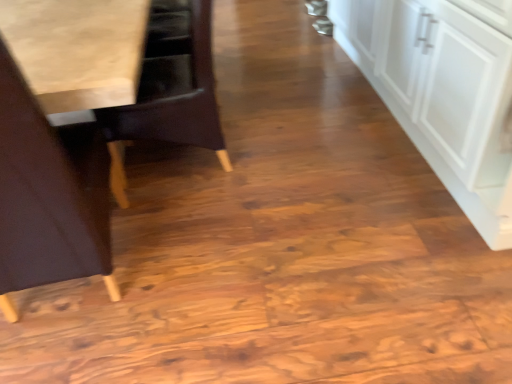
What is the approximate width of white matte cabinet at right?

white matte cabinet at right is 24.91 inches in width.

Find the location of a particular element. This screenshot has width=512, height=384. light brown wood chair at left, which is counted as the second chair, starting from the back is located at coordinates (49, 196).

Where is `wooden chair at left, which is the 2th chair from front to back`? The height and width of the screenshot is (384, 512). wooden chair at left, which is the 2th chair from front to back is located at coordinates (169, 92).

Is point (483, 60) less distant than point (15, 151)?

No, (483, 60) is further to viewer.

From the picture: Does white matte cabinet at right have a larger size compared to light brown wood chair at left, arranged as the first chair when viewed from the front?

Indeed, white matte cabinet at right has a larger size compared to light brown wood chair at left, arranged as the first chair when viewed from the front.

Is white matte cabinet at right looking in the opposite direction of light brown wood chair at left, arranged as the first chair when viewed from the front?

white matte cabinet at right is not turned away from light brown wood chair at left, arranged as the first chair when viewed from the front.

From the image's perspective, is white matte cabinet at right positioned above or below light brown wood chair at left, arranged as the first chair when viewed from the front?

white matte cabinet at right is situated higher than light brown wood chair at left, arranged as the first chair when viewed from the front, in the image.

Is point (106, 214) closer to camera compared to point (426, 104)?

Yes.

Would you say white matte cabinet at right is part of light brown wood chair at left, which is counted as the second chair, starting from the back,'s contents?

No, white matte cabinet at right is located outside of light brown wood chair at left, which is counted as the second chair, starting from the back.

From the picture: Which object is positioned more to the left, light brown wood chair at left, which is counted as the second chair, starting from the back, or white matte cabinet at right?

Positioned to the left is light brown wood chair at left, which is counted as the second chair, starting from the back.

Are light brown wood chair at left, which is counted as the second chair, starting from the back, and wooden chair at left, positioned as the first chair in back-to-front order, beside each other?

No, light brown wood chair at left, which is counted as the second chair, starting from the back, is not next to wooden chair at left, positioned as the first chair in back-to-front order.

In the scene shown: Could you tell me if light brown wood chair at left, which is counted as the second chair, starting from the back, is facing wooden chair at left, positioned as the first chair in back-to-front order?

No.

I want to click on chair below the light brown wood chair at left, arranged as the first chair when viewed from the front (from a real-world perspective), so click(169, 92).

Is the depth of wooden chair at left, positioned as the first chair in back-to-front order, less than that of light brown wood chair at left, arranged as the first chair when viewed from the front?

No, it is not.

Which is more distant, (x=205, y=5) or (x=104, y=186)?

The point (x=205, y=5) is farther.

From the image's perspective, is wooden chair at left, positioned as the first chair in back-to-front order, below light brown wood chair at left, arranged as the first chair when viewed from the front?

No.

Between wooden chair at left, which is the 2th chair from front to back, and light brown wood chair at left, which is counted as the second chair, starting from the back, which one has smaller width?

With smaller width is wooden chair at left, which is the 2th chair from front to back.

What's the angular difference between white matte cabinet at right and wooden chair at left, positioned as the first chair in back-to-front order,'s facing directions?

The facing directions of white matte cabinet at right and wooden chair at left, positioned as the first chair in back-to-front order, are 0.659 degrees apart.

Does point (455, 32) lie behind point (142, 123)?

No, it is not.

From a real-world perspective, is white matte cabinet at right on top of wooden chair at left, which is the 2th chair from front to back?

Incorrect, from a real-world perspective, white matte cabinet at right is lower than wooden chair at left, which is the 2th chair from front to back.

Is white matte cabinet at right positioned far away from wooden chair at left, positioned as the first chair in back-to-front order?

Indeed, white matte cabinet at right is not near wooden chair at left, positioned as the first chair in back-to-front order.

Does wooden chair at left, positioned as the first chair in back-to-front order, lie behind white matte cabinet at right?

Yes, wooden chair at left, positioned as the first chair in back-to-front order, is further from the viewer.

From the image's perspective, which is below, wooden chair at left, positioned as the first chair in back-to-front order, or white matte cabinet at right?

wooden chair at left, positioned as the first chair in back-to-front order, is shown below in the image.

Can white matte cabinet at right be found inside wooden chair at left, which is the 2th chair from front to back?

No.

From the white matte cabinet at right, count the 1st chair to the left and point to it. Please provide its 2D coordinates.

[(169, 92)]

In the image, there is a light brown wood chair at left, which is counted as the second chair, starting from the back. What are the coordinates of `cabinetry below it (from a real-world perspective)` in the screenshot? It's located at (441, 94).

The width and height of the screenshot is (512, 384). Identify the location of the 2nd chair located above the white matte cabinet at right (from a real-world perspective). (49, 196).

Considering their positions, is white matte cabinet at right positioned closer to light brown wood chair at left, which is counted as the second chair, starting from the back, than wooden chair at left, which is the 2th chair from front to back?

wooden chair at left, which is the 2th chair from front to back.

From the picture: Considering their positions, is light brown wood chair at left, which is counted as the second chair, starting from the back, positioned closer to white matte cabinet at right than wooden chair at left, which is the 2th chair from front to back?

Among the two, wooden chair at left, which is the 2th chair from front to back, is located nearer to white matte cabinet at right.

Based on their spatial positions, is light brown wood chair at left, which is counted as the second chair, starting from the back, or white matte cabinet at right closer to wooden chair at left, which is the 2th chair from front to back?

The object closer to wooden chair at left, which is the 2th chair from front to back, is light brown wood chair at left, which is counted as the second chair, starting from the back.

Looking at the image, which one is located closer to wooden chair at left, which is the 2th chair from front to back, white matte cabinet at right or light brown wood chair at left, arranged as the first chair when viewed from the front?

light brown wood chair at left, arranged as the first chair when viewed from the front.

When comparing their distances from white matte cabinet at right, does wooden chair at left, which is the 2th chair from front to back, or light brown wood chair at left, which is counted as the second chair, starting from the back, seem closer?

Based on the image, wooden chair at left, which is the 2th chair from front to back, appears to be nearer to white matte cabinet at right.

When comparing their distances from light brown wood chair at left, arranged as the first chair when viewed from the front, does wooden chair at left, which is the 2th chair from front to back, or white matte cabinet at right seem closer?

wooden chair at left, which is the 2th chair from front to back, is positioned closer to the anchor light brown wood chair at left, arranged as the first chair when viewed from the front.

Locate an element on the screen. chair between light brown wood chair at left, which is counted as the second chair, starting from the back, and white matte cabinet at right is located at coordinates (169, 92).